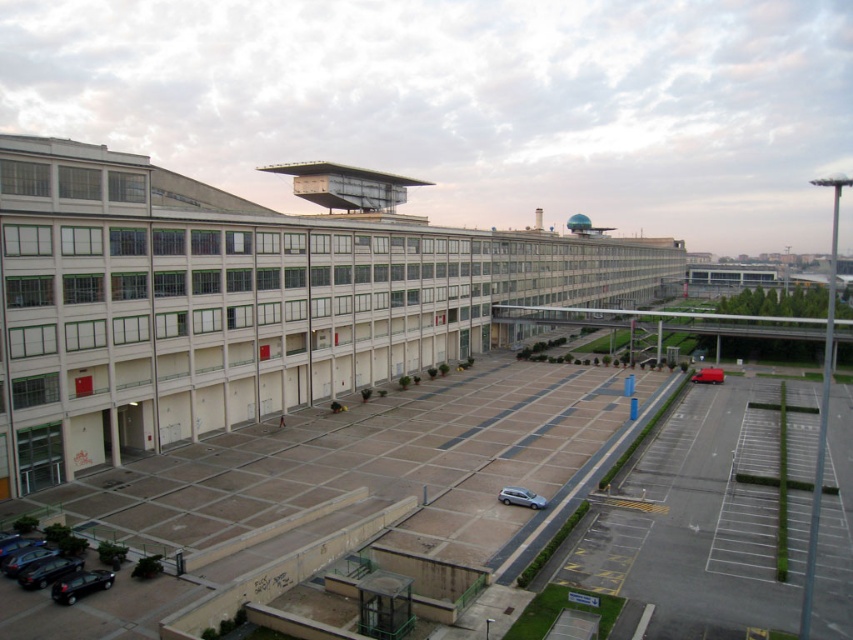
Question: Is white concrete parking garage at center in front of satin silver car at center?

Choices:
 (A) no
 (B) yes

Answer: (B)

Question: Which point is farther from the camera taking this photo?

Choices:
 (A) (515, 496)
 (B) (706, 376)

Answer: (B)

Question: Which point is farther to the camera?

Choices:
 (A) (99, 577)
 (B) (523, 496)
 (C) (77, 294)
 (D) (721, 376)

Answer: (D)

Question: Which point is farther to the camera?

Choices:
 (A) matte red van at lower right
 (B) shiny black car at lower left
 (C) white concrete parking garage at center
 (D) satin silver car at center

Answer: (A)

Question: Can you confirm if shiny black car at lower left is positioned to the left of matte red van at lower right?

Choices:
 (A) no
 (B) yes

Answer: (B)

Question: Is shiny black car at lower left wider than satin silver car at center?

Choices:
 (A) no
 (B) yes

Answer: (A)